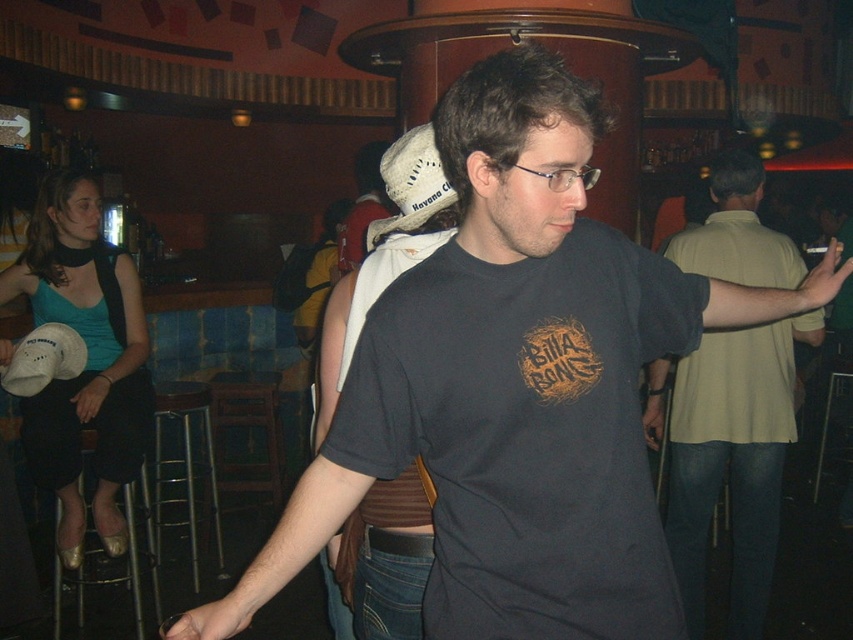
Is dark gray cotton t-shirt at center above light beige shirt at right?

Yes.

Where is `dark gray cotton t-shirt at center`? This screenshot has width=853, height=640. dark gray cotton t-shirt at center is located at coordinates (527, 433).

Locate an element on the screen. The width and height of the screenshot is (853, 640). dark gray cotton t-shirt at center is located at coordinates (527, 433).

What do you see at coordinates (527, 433) in the screenshot? This screenshot has height=640, width=853. I see `dark gray cotton t-shirt at center` at bounding box center [527, 433].

Is dark gray cotton t-shirt at center below black matte t-shirt at center?

Yes, dark gray cotton t-shirt at center is below black matte t-shirt at center.

Is point (660, 556) positioned after point (374, 488)?

No, it is not.

Locate an element on the screen. dark gray cotton t-shirt at center is located at coordinates (527, 433).

Is light beige shirt at right wider than black matte t-shirt at center?

Correct, the width of light beige shirt at right exceeds that of black matte t-shirt at center.

Which is in front, point (727, 244) or point (432, 177)?

Positioned in front is point (432, 177).

Is point (671, 426) positioned after point (418, 540)?

That is True.

Locate an element on the screen. The image size is (853, 640). light beige shirt at right is located at coordinates (732, 460).